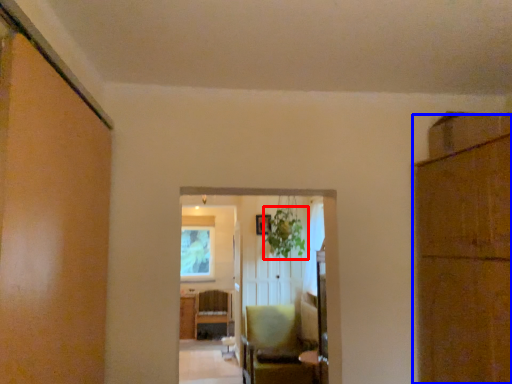
Question: Which object appears farthest to the camera in this image, plant (highlighted by a red box) or cabinetry (highlighted by a blue box)?

Choices:
 (A) plant
 (B) cabinetry

Answer: (A)